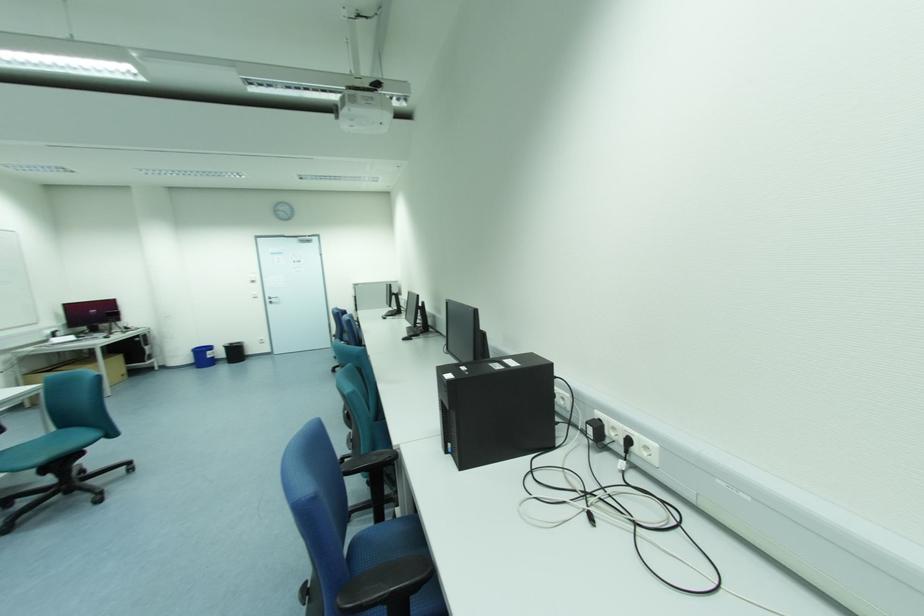
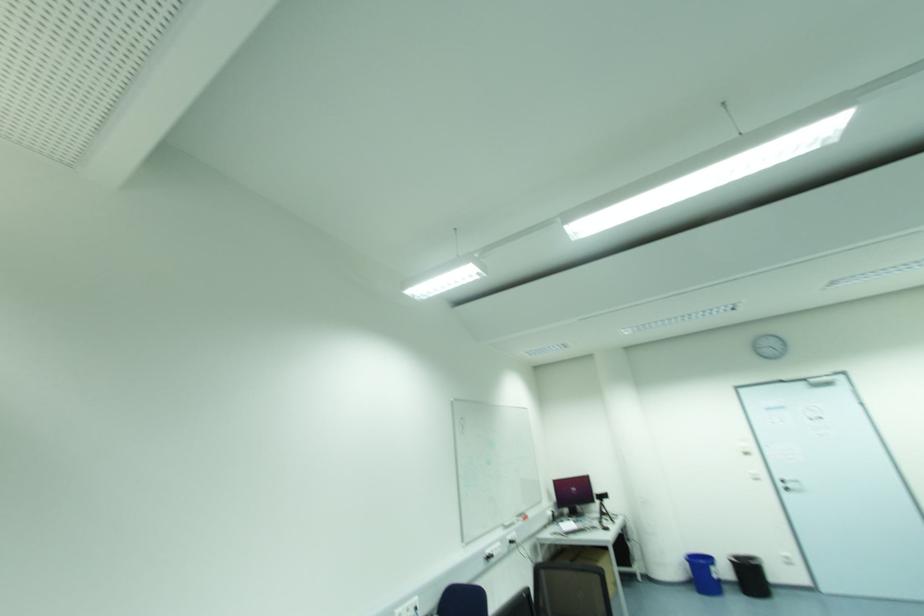
In the second image, find the point that corresponds to (x=210, y=353) in the first image.

(714, 570)